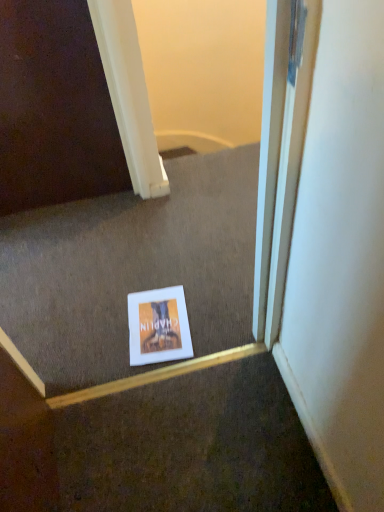
Question: Should I look upward or downward to see matte cardboard book at center?

Choices:
 (A) down
 (B) up

Answer: (A)

Question: Considering the relative sizes of white paper at center and matte cardboard book at center in the image provided, is white paper at center bigger than matte cardboard book at center?

Choices:
 (A) yes
 (B) no

Answer: (A)

Question: From a real-world perspective, is white paper at center located beneath matte cardboard book at center?

Choices:
 (A) yes
 (B) no

Answer: (B)

Question: Is white paper at center located outside matte cardboard book at center?

Choices:
 (A) yes
 (B) no

Answer: (A)

Question: Considering the relative sizes of white paper at center and matte cardboard book at center in the image provided, is white paper at center smaller than matte cardboard book at center?

Choices:
 (A) yes
 (B) no

Answer: (B)

Question: Is matte cardboard book at center at the back of white paper at center?

Choices:
 (A) no
 (B) yes

Answer: (A)

Question: Could you tell me if white paper at center is turned towards matte cardboard book at center?

Choices:
 (A) no
 (B) yes

Answer: (B)

Question: From a real-world perspective, is matte cardboard book at center below white paper at center?

Choices:
 (A) no
 (B) yes

Answer: (B)

Question: Are matte cardboard book at center and white paper at center located far from each other?

Choices:
 (A) yes
 (B) no

Answer: (B)

Question: Is matte cardboard book at center positioned in front of white paper at center?

Choices:
 (A) yes
 (B) no

Answer: (B)

Question: Considering the relative sizes of matte cardboard book at center and white paper at center in the image provided, is matte cardboard book at center thinner than white paper at center?

Choices:
 (A) no
 (B) yes

Answer: (B)

Question: Is matte cardboard book at center completely or partially outside of white paper at center?

Choices:
 (A) yes
 (B) no

Answer: (B)

Question: Is matte cardboard book at center bigger than white paper at center?

Choices:
 (A) no
 (B) yes

Answer: (A)

Question: In terms of size, does matte cardboard book at center appear bigger or smaller than white paper at center?

Choices:
 (A) small
 (B) big

Answer: (A)